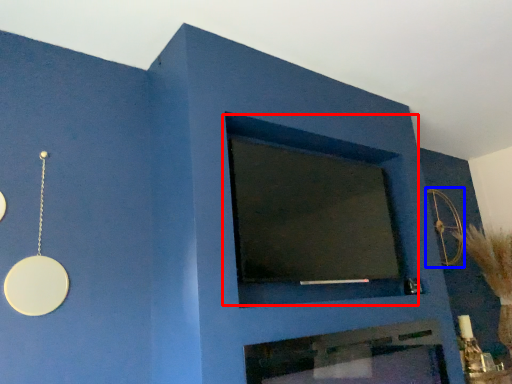
Question: Among these objects, which one is farthest to the camera, window (highlighted by a red box) or circle (highlighted by a blue box)?

Choices:
 (A) window
 (B) circle

Answer: (B)